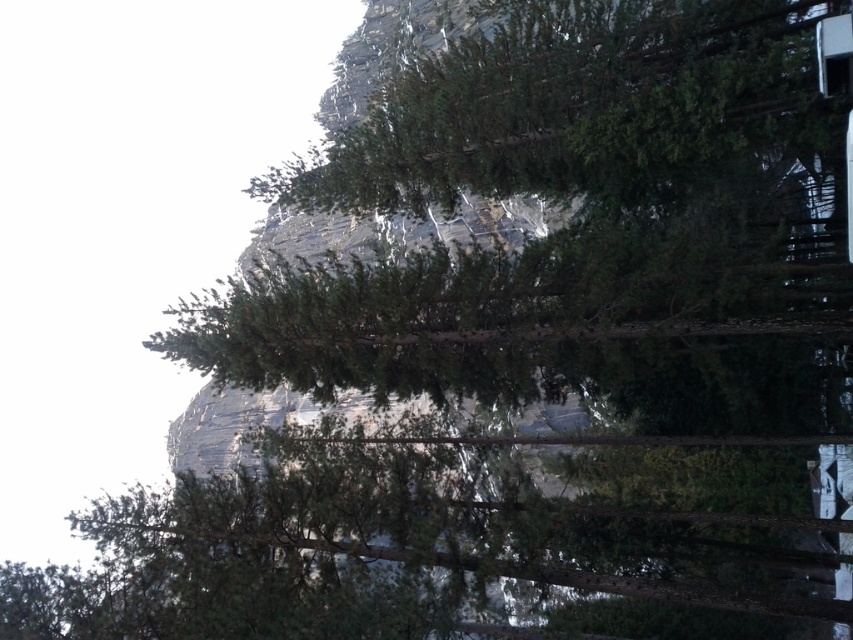
Question: Which of the following is the farthest from the observer?

Choices:
 (A) green matte tree at upper center
 (B) transparent glass train window at upper right

Answer: (A)

Question: Observing the image, what is the correct spatial positioning of green matte tree at upper center in reference to transparent glass train window at upper right?

Choices:
 (A) right
 (B) left

Answer: (B)

Question: Can you confirm if green matte tree at upper center is bigger than transparent glass train window at upper right?

Choices:
 (A) no
 (B) yes

Answer: (B)

Question: Which point is farther from the camera taking this photo?

Choices:
 (A) [477, 150]
 (B) [827, 61]

Answer: (A)

Question: Which object is farther from the camera taking this photo?

Choices:
 (A) transparent glass train window at upper right
 (B) green matte tree at upper center

Answer: (B)

Question: Does green matte tree at upper center appear over transparent glass train window at upper right?

Choices:
 (A) no
 (B) yes

Answer: (B)